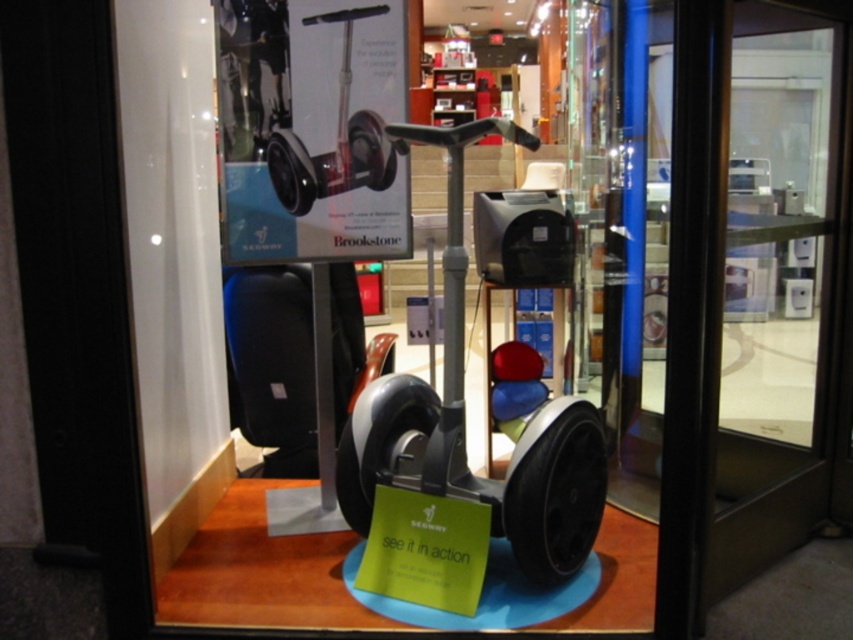
Describe the element at coordinates (212, 360) in the screenshot. I see `metallic gray hoverboard at center` at that location.

Who is more forward, (218, 420) or (357, 10)?

Point (357, 10)

The height and width of the screenshot is (640, 853). What do you see at coordinates (212, 360) in the screenshot?
I see `metallic gray hoverboard at center` at bounding box center [212, 360].

Locate an element on the screen. The height and width of the screenshot is (640, 853). metallic gray hoverboard at center is located at coordinates (212, 360).

How much distance is there between matte gray scooter at center and silver metallic segway at center?

matte gray scooter at center and silver metallic segway at center are 19.12 inches apart from each other.

Can you confirm if matte gray scooter at center is shorter than silver metallic segway at center?

No, matte gray scooter at center is not shorter than silver metallic segway at center.

Who is more forward, (451,454) or (277,186)?

Point (451,454) is in front.

You are a GUI agent. You are given a task and a screenshot of the screen. Output one action in this format:
    pyautogui.click(x=<x>, y=<y>)
    Task: Click on the matte gray scooter at center
    The height and width of the screenshot is (640, 853).
    Given the screenshot: What is the action you would take?
    pyautogui.click(x=463, y=420)

Can you confirm if metallic gray hoverboard at center is wider than matte gray scooter at center?

No, metallic gray hoverboard at center is not wider than matte gray scooter at center.

Which of these two, metallic gray hoverboard at center or matte gray scooter at center, stands shorter?

matte gray scooter at center is shorter.

Is point (332, 116) positioned in front of point (529, 509)?

No, it is behind (529, 509).

Image resolution: width=853 pixels, height=640 pixels. In order to click on metallic gray hoverboard at center in this screenshot , I will do `click(212, 360)`.